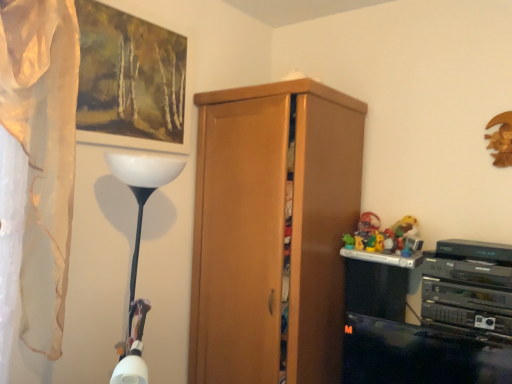
Question: From a real-world perspective, is wooden cabinet at center positioned above or below white sheer curtain at left?

Choices:
 (A) above
 (B) below

Answer: (B)

Question: Relative to white sheer curtain at left, is wooden cabinet at center in front or behind?

Choices:
 (A) behind
 (B) front

Answer: (A)

Question: Which object is positioned closest to the wooden picture frame at upper left?

Choices:
 (A) wooden cabinet at center
 (B) white sheer curtain at left

Answer: (B)

Question: Which object is the closest to the white sheer curtain at left?

Choices:
 (A) wooden cabinet at center
 (B) wooden picture frame at upper left

Answer: (B)